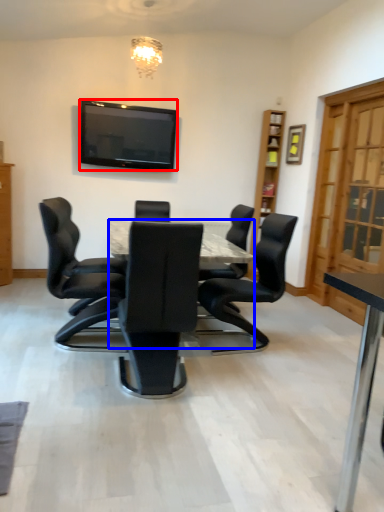
Question: Which of the following is the farthest to the observer, television (highlighted by a red box) or desk (highlighted by a blue box)?

Choices:
 (A) television
 (B) desk

Answer: (A)